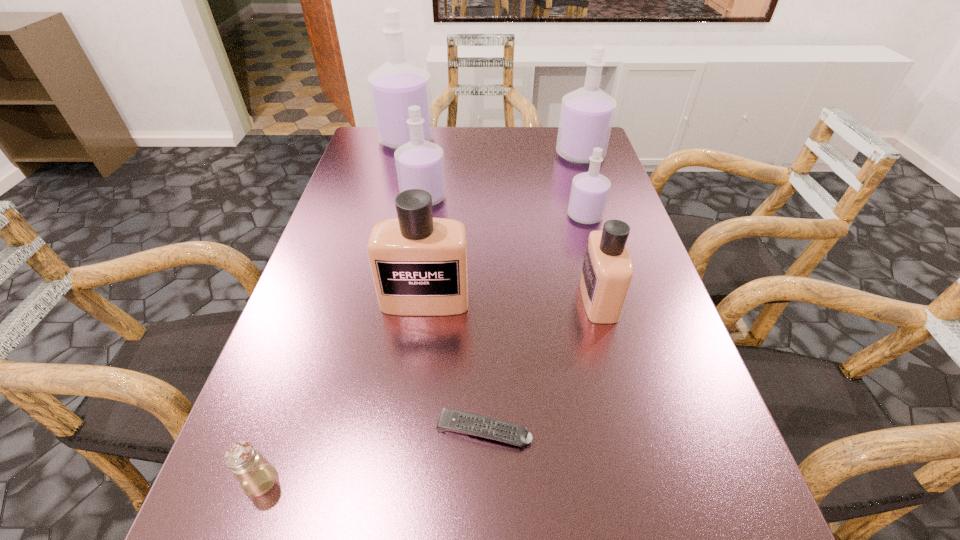
Where is `vacant point located between the nearest object and the bigger beige perfume`? This screenshot has height=540, width=960. vacant point located between the nearest object and the bigger beige perfume is located at coordinates (344, 390).

This screenshot has height=540, width=960. Find the location of `vacant area that lies between the smaller beige perfume and the second smallest purple perfume`. vacant area that lies between the smaller beige perfume and the second smallest purple perfume is located at coordinates (511, 248).

Identify which object is located as the third nearest to the smallest purple perfume. Please provide its 2D coordinates. Your answer should be formatted as a tuple, i.e. [(x, y)], where the tuple contains the x and y coordinates of a point satisfying the conditions above.

[(419, 163)]

Locate which object is the closest to the smaller beige perfume. Please provide its 2D coordinates. Your answer should be formatted as a tuple, i.e. [(x, y)], where the tuple contains the x and y coordinates of a point satisfying the conditions above.

[(589, 193)]

Identify which perfume is located as the fourth nearest to the smallest purple perfume. Please provide its 2D coordinates. Your answer should be formatted as a tuple, i.e. [(x, y)], where the tuple contains the x and y coordinates of a point satisfying the conditions above.

[(419, 264)]

Locate an element on the screen. perfume that is the closest one to the right beige perfume is located at coordinates [589, 193].

Find the location of `purple perfume identified as the third closest to the bigger beige perfume`. purple perfume identified as the third closest to the bigger beige perfume is located at coordinates (586, 117).

Where is `purple perfume that stands as the third closest to the second tallest object`? purple perfume that stands as the third closest to the second tallest object is located at coordinates (397, 84).

Locate an element on the screen. free spot that satisfies the following two spatial constraints: 1. on the front label of the smaller beige perfume; 2. on the front label of the left beige perfume is located at coordinates (598, 300).

The height and width of the screenshot is (540, 960). What are the coordinates of `free spot that satisfies the following two spatial constraints: 1. on the front side of the shortest object; 2. on the right side of the biggest purple perfume` in the screenshot? It's located at (333, 430).